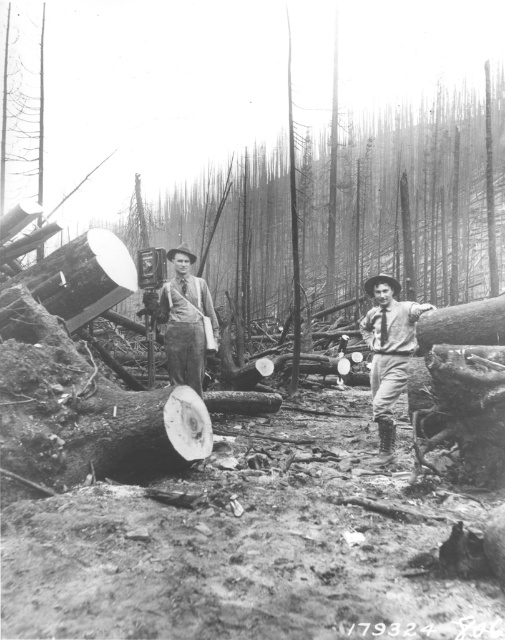
You are a photographer standing in the forest scene. You notice a point marked at coordinates (388,352). What object is located at that point?

The point at coordinates (388,352) is on rugged denim pants at center.